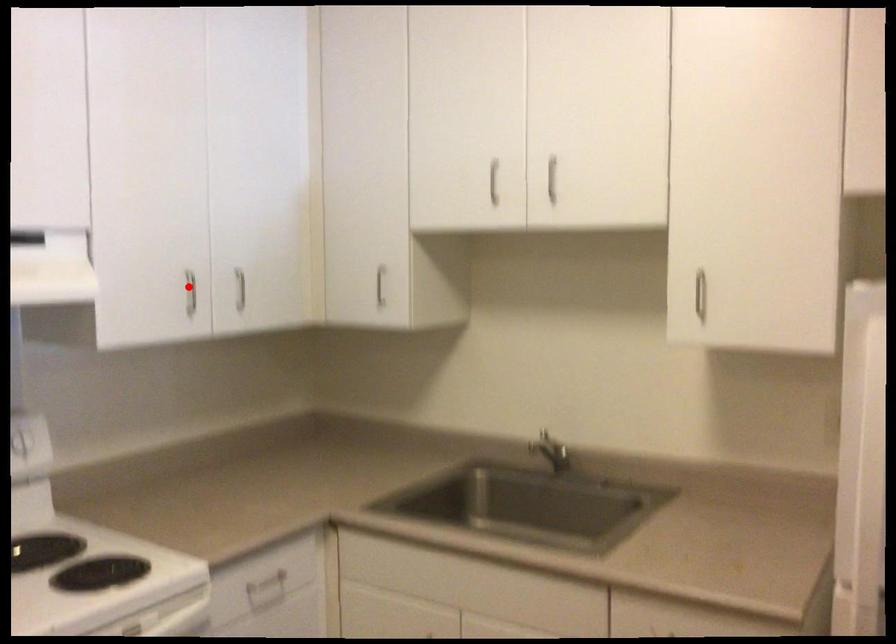
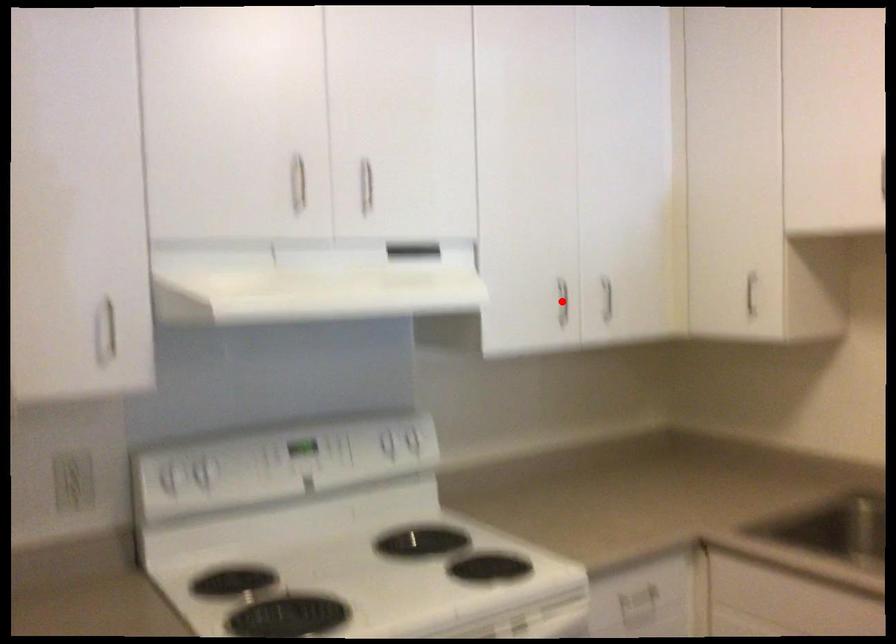
I am providing you with two images of the same scene from different viewpoints. A red point is marked on the first image and another point is marked on the second image. Are the points marked in image1 and image2 representing the same 3D position?

Yes